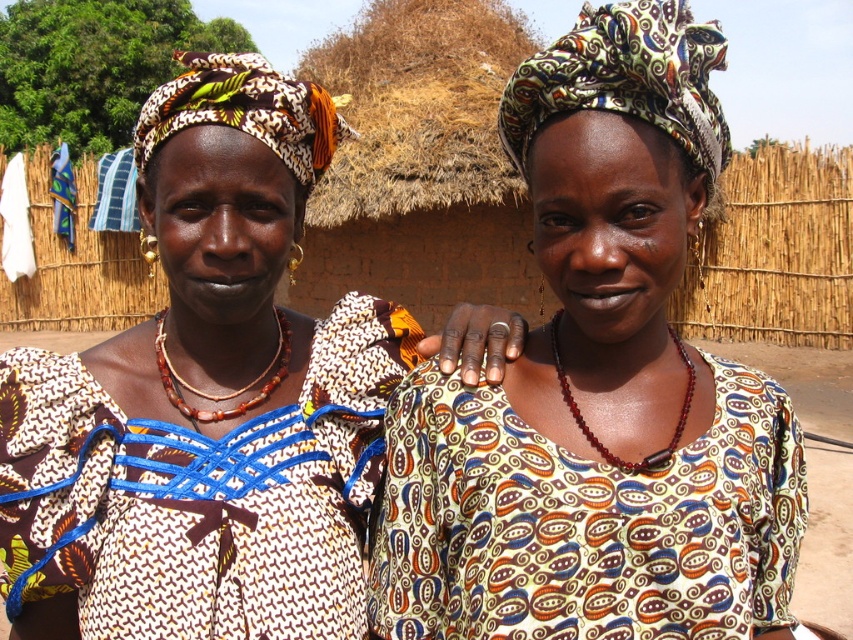
Between printed fabric headscarf at upper center and printed fabric dress at center, which one is positioned higher?

printed fabric headscarf at upper center is higher up.

Looking at this image, measure the distance between printed fabric headscarf at upper center and camera.

printed fabric headscarf at upper center is 3.46 feet from camera.

Which is in front, point (714, 548) or point (374, 547)?

Point (714, 548)

This screenshot has width=853, height=640. What are the coordinates of `printed fabric headscarf at upper center` in the screenshot? It's located at (598, 387).

Between printed fabric blouse at center and printed fabric dress at center, which one has more height?

printed fabric blouse at center

Is point (268, 381) behind point (550, 596)?

Yes, point (268, 381) is behind point (550, 596).

Who is more distant from viewer, (233, 90) or (627, 502)?

The point (233, 90) is more distant.

The width and height of the screenshot is (853, 640). I want to click on printed fabric blouse at center, so click(x=206, y=400).

The image size is (853, 640). In order to click on printed fabric headscarf at upper center in this screenshot , I will do `click(598, 387)`.

Is point (589, 221) more distant than point (270, 586)?

No.

This screenshot has width=853, height=640. What are the coordinates of `printed fabric headscarf at upper center` in the screenshot? It's located at (598, 387).